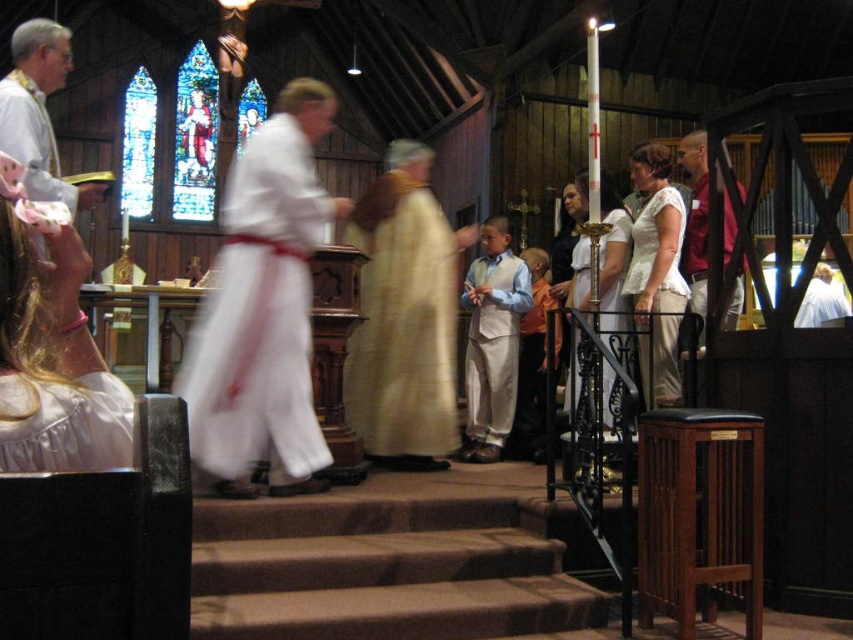
You are a photographer positioned at the back of the church and want to capture a clear shot of both the white lace blouse at center and the matte white dress at center. Since the camera can only focus on one subject at a time, which item should you prioritize to ensure the details of the wider garment are visible?

The white lace blouse at center is wider than the matte white dress at center, so you should prioritize focusing on the white lace blouse at center to capture its details clearly.

You are a photographer trying to capture the scene inside the church. You notice the white lace blouse at center and the matte white dress at center. Which clothing item is covering the other?

The white lace blouse at center is positioned over the matte white dress at center, so it is covering the dress.

You are standing in the church and want to hand a flower bouquet to the person wearing the white satin dress at lower left and the light beige fabric dress at center. Which one can you reach first without moving closer?

The white satin dress at lower left is closer to the viewer than the light beige fabric dress at center, so you can reach the person wearing the white satin dress at lower left first without moving closer.